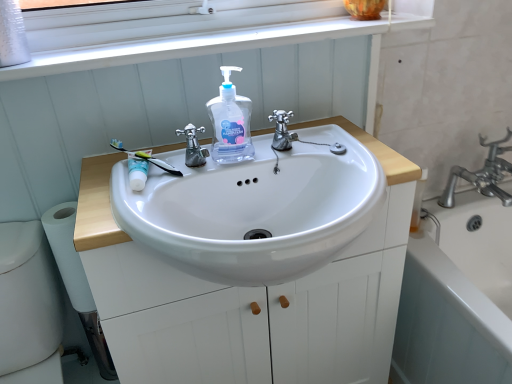
This screenshot has width=512, height=384. I want to click on vacant space in front of green rubber toothbrush at upper left, so click(x=118, y=203).